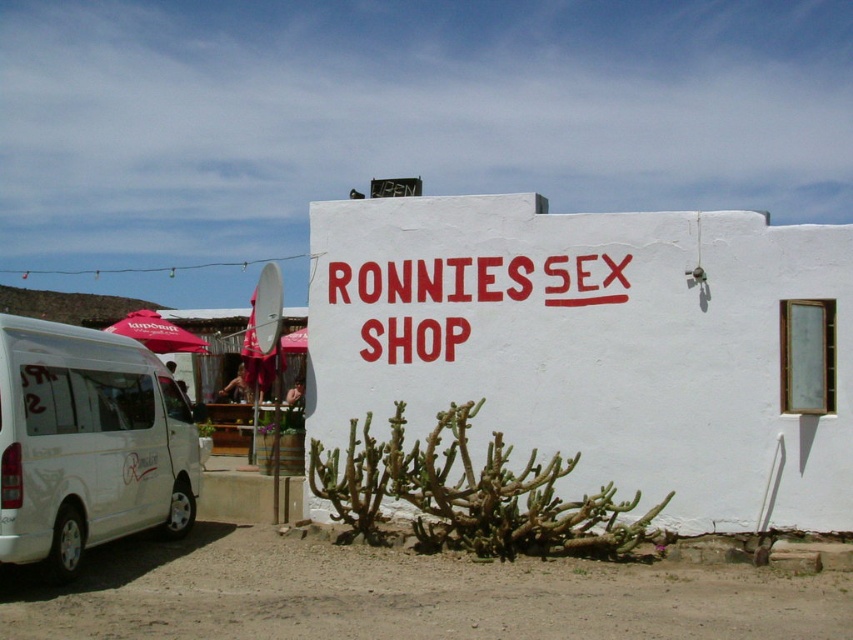
You are standing in front of the white building with the red sign. You need to take a photo of the entire building without any obstructions. Is the white matte van at lower left blocking your view of the building?

The white matte van at lower left is parked to the left of the building and partially obscures the view of the shop. Since the van is at point (86, 444), it might still be blocking part of the building, so you might need to move to the right to get an unobstructed view.